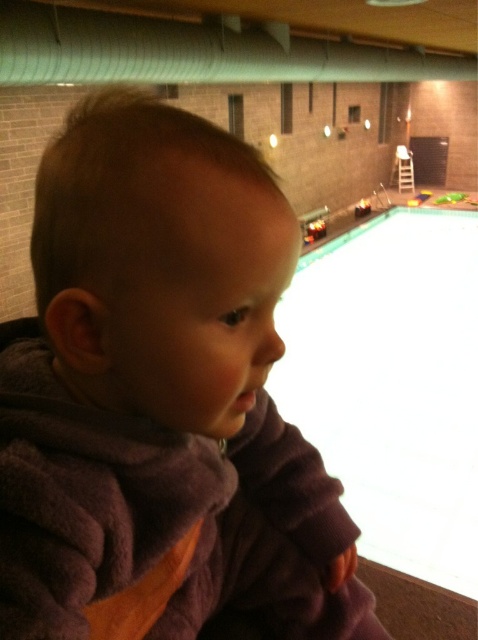
Question: Can you confirm if purple fleece toddler at center is smaller than white smooth water at center?

Choices:
 (A) no
 (B) yes

Answer: (B)

Question: Is purple fleece toddler at center to the left of white smooth water at center from the viewer's perspective?

Choices:
 (A) no
 (B) yes

Answer: (B)

Question: Which point appears farthest from the camera in this image?

Choices:
 (A) (369, 400)
 (B) (71, 237)

Answer: (A)

Question: Which point is farther from the camera taking this photo?

Choices:
 (A) (220, 403)
 (B) (307, 275)

Answer: (B)

Question: Does purple fleece toddler at center appear on the left side of white smooth water at center?

Choices:
 (A) yes
 (B) no

Answer: (A)